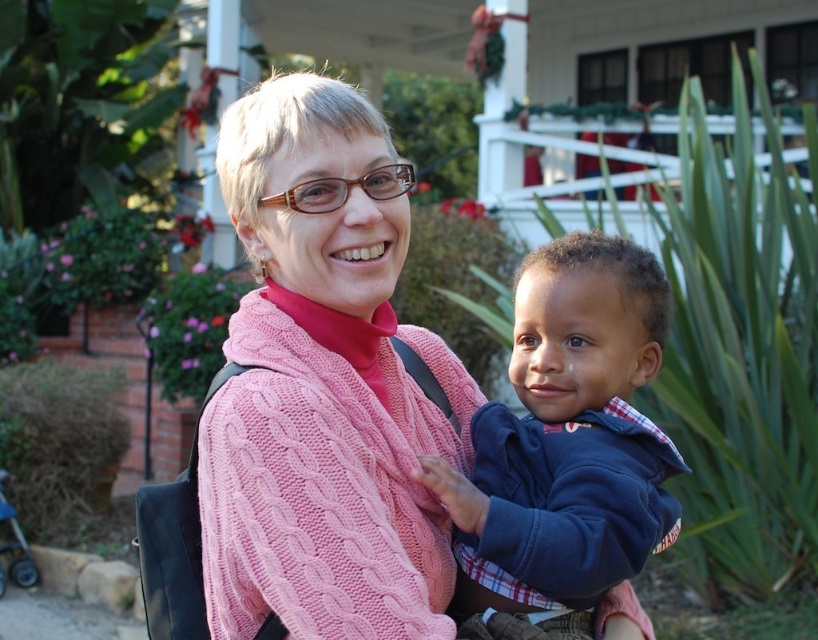
Question: Which point is farther from the camera taking this photo?

Choices:
 (A) (639, 620)
 (B) (329, 173)

Answer: (A)

Question: Which of the following is the farthest from the observer?

Choices:
 (A) (542, 429)
 (B) (392, 179)
 (C) (207, 474)

Answer: (B)

Question: Which object is farther from the camera taking this photo?

Choices:
 (A) blue fleece jacket at center
 (B) cable-knit pink shawl at center

Answer: (A)

Question: Does pink knitted sweater at center lie in front of cable-knit pink shawl at center?

Choices:
 (A) yes
 (B) no

Answer: (B)

Question: Can you confirm if cable-knit pink shawl at center is smaller than blue fleece jacket at center?

Choices:
 (A) yes
 (B) no

Answer: (B)

Question: Is cable-knit pink shawl at center thinner than blue fleece jacket at center?

Choices:
 (A) no
 (B) yes

Answer: (A)